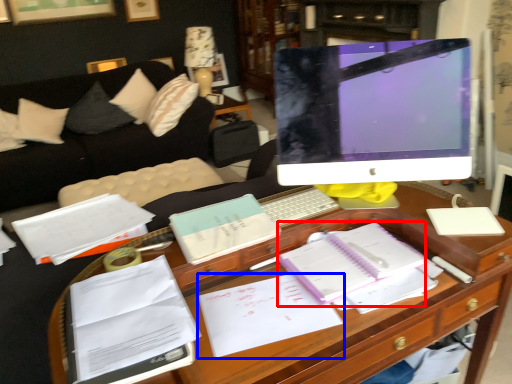
Question: Which point is further to the camera, notebook (highlighted by a red box) or document (highlighted by a blue box)?

Choices:
 (A) notebook
 (B) document

Answer: (A)